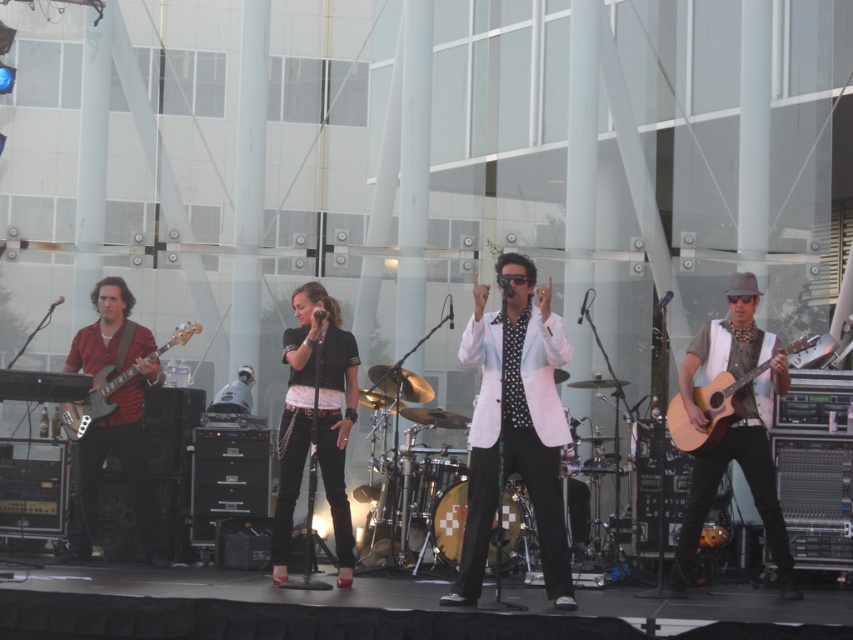
Can you confirm if matte red guitar at left is thinner than matte black bass at left?

Yes, matte red guitar at left is thinner than matte black bass at left.

The height and width of the screenshot is (640, 853). What do you see at coordinates (114, 420) in the screenshot? I see `matte red guitar at left` at bounding box center [114, 420].

Is point (131, 355) positioned before point (67, 422)?

No, it is not.

You are a GUI agent. You are given a task and a screenshot of the screen. Output one action in this format:
    pyautogui.click(x=<x>, y=<y>)
    Task: Click on the matte red guitar at left
    
    Given the screenshot: What is the action you would take?
    pyautogui.click(x=114, y=420)

Can you confirm if white polka dot shirt at center is taller than matte red guitar at left?

Yes, white polka dot shirt at center is taller than matte red guitar at left.

Is point (552, 397) positioned after point (105, 291)?

No.

Is point (521, 352) closer to camera compared to point (146, 460)?

Yes, point (521, 352) is closer to viewer.

At what (x,y) coordinates should I click in order to perform the action: click on white polka dot shirt at center. Please return your answer as a coordinate pair (x, y). This screenshot has height=640, width=853. Looking at the image, I should click on (515, 424).

Which is above, white polka dot shirt at center or black leather jacket at center?

white polka dot shirt at center is above.

What do you see at coordinates (515, 424) in the screenshot? I see `white polka dot shirt at center` at bounding box center [515, 424].

The width and height of the screenshot is (853, 640). I want to click on white polka dot shirt at center, so click(x=515, y=424).